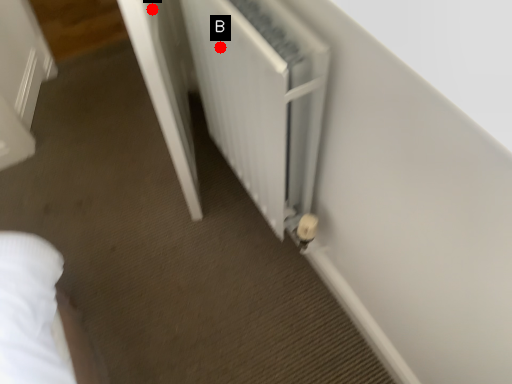
Question: Two points are circled on the image, labeled by A and B beside each circle. Which point is further to the camera?

Choices:
 (A) A is further
 (B) B is further

Answer: (B)